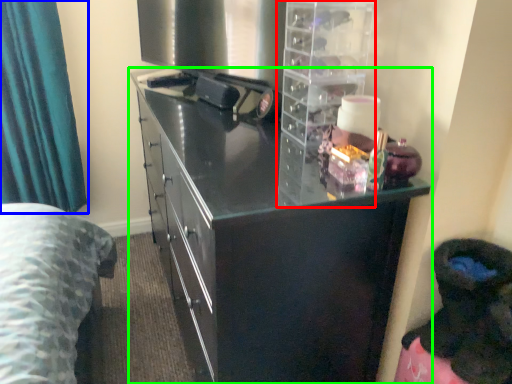
Question: Based on their relative distances, which object is farther from cabinet (highlighted by a red box)? Choose from curtain (highlighted by a blue box) and cupboard (highlighted by a green box).

Choices:
 (A) curtain
 (B) cupboard

Answer: (A)